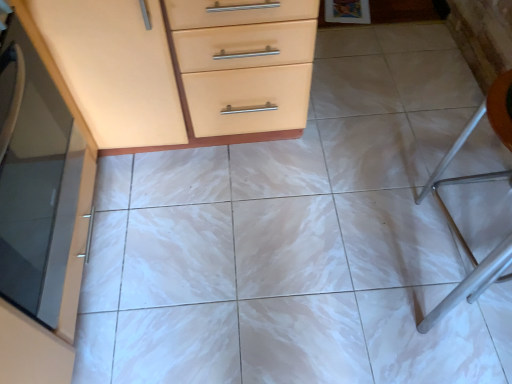
Where is `free space in front of orange plastic folding chair at right`? This screenshot has width=512, height=384. free space in front of orange plastic folding chair at right is located at coordinates (459, 336).